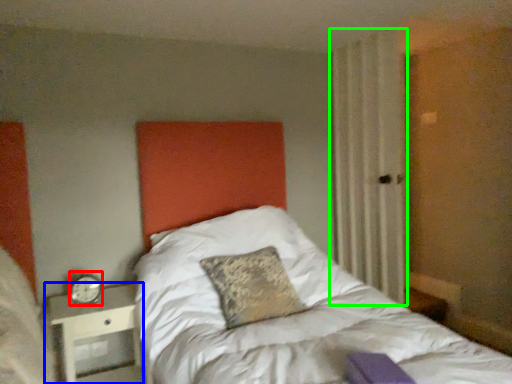
Question: Based on their relative distances, which object is farther from alarm clock (highlighted by a red box)? Choose from nightstand (highlighted by a blue box) and curtain (highlighted by a green box).

Choices:
 (A) nightstand
 (B) curtain

Answer: (B)